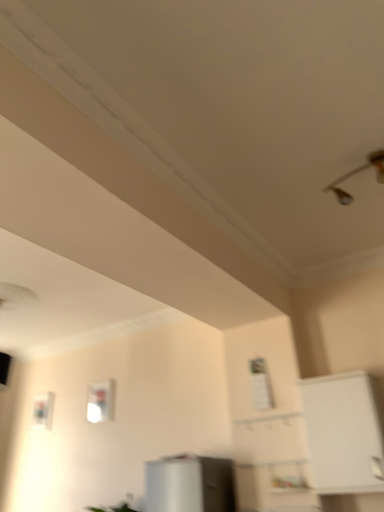
Question: From the image's perspective, is metallic silver light fixture at upper right located beneath white matte cabinet at right?

Choices:
 (A) no
 (B) yes

Answer: (A)

Question: From a real-world perspective, is metallic silver light fixture at upper right on white matte cabinet at right?

Choices:
 (A) no
 (B) yes

Answer: (B)

Question: From a real-world perspective, is metallic silver light fixture at upper right below white matte cabinet at right?

Choices:
 (A) yes
 (B) no

Answer: (B)

Question: Does metallic silver light fixture at upper right appear on the right side of white matte cabinet at right?

Choices:
 (A) no
 (B) yes

Answer: (A)

Question: Is metallic silver light fixture at upper right at the left side of white matte cabinet at right?

Choices:
 (A) yes
 (B) no

Answer: (A)

Question: Considering the positions of point (349, 173) and point (365, 470), is point (349, 173) closer or farther from the camera than point (365, 470)?

Choices:
 (A) closer
 (B) farther

Answer: (A)

Question: Considering the positions of metallic silver light fixture at upper right and white matte cabinet at right in the image, is metallic silver light fixture at upper right wider or thinner than white matte cabinet at right?

Choices:
 (A) wide
 (B) thin

Answer: (A)

Question: From their relative heights in the image, would you say metallic silver light fixture at upper right is taller or shorter than white matte cabinet at right?

Choices:
 (A) tall
 (B) short

Answer: (B)

Question: Considering their positions, is metallic silver light fixture at upper right located in front of or behind white matte cabinet at right?

Choices:
 (A) behind
 (B) front

Answer: (B)

Question: From the image's perspective, relative to transparent glass window at center, is white matte cabinet at right above or below?

Choices:
 (A) below
 (B) above

Answer: (B)

Question: Considering their positions, is white matte cabinet at right located in front of or behind transparent glass window at center?

Choices:
 (A) behind
 (B) front

Answer: (B)

Question: Is white matte cabinet at right bigger or smaller than transparent glass window at center?

Choices:
 (A) small
 (B) big

Answer: (B)

Question: From their relative heights in the image, would you say white matte cabinet at right is taller or shorter than transparent glass window at center?

Choices:
 (A) short
 (B) tall

Answer: (B)

Question: Based on their sizes in the image, would you say metallic silver light fixture at upper right is bigger or smaller than transparent glass window at center?

Choices:
 (A) small
 (B) big

Answer: (B)

Question: Considering the positions of metallic silver light fixture at upper right and transparent glass window at center in the image, is metallic silver light fixture at upper right wider or thinner than transparent glass window at center?

Choices:
 (A) thin
 (B) wide

Answer: (B)